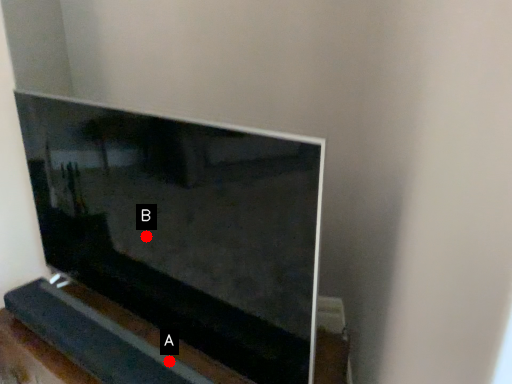
Question: Two points are circled on the image, labeled by A and B beside each circle. Which point is farther from the camera taking this photo?

Choices:
 (A) A is further
 (B) B is further

Answer: (B)